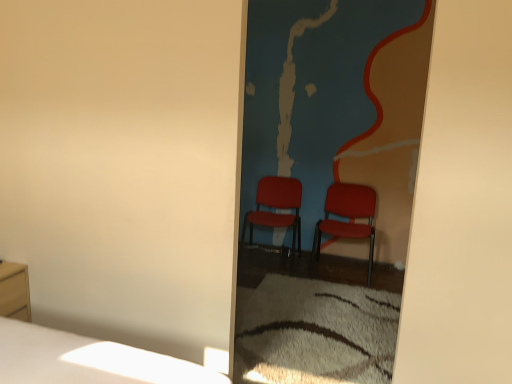
Image resolution: width=512 pixels, height=384 pixels. What do you see at coordinates (14, 290) in the screenshot? I see `matte wood nightstand at lower left` at bounding box center [14, 290].

From the picture: Measure the distance between point (20, 306) and camera.

The depth of point (20, 306) is 8.53 feet.

You are a GUI agent. You are given a task and a screenshot of the screen. Output one action in this format:
    pyautogui.click(x=<x>, y=<y>)
    Task: Click on the matte red chair at center, the 1th chair from the left
    
    Given the screenshot: What is the action you would take?
    pyautogui.click(x=276, y=207)

From their relative heights in the image, would you say matte wood nightstand at lower left is taller or shorter than matte red chairs at center?

In the image, matte wood nightstand at lower left appears to be shorter than matte red chairs at center.

Is matte wood nightstand at lower left located outside matte red chairs at center?

matte wood nightstand at lower left lies outside matte red chairs at center's area.

At what (x,y) coordinates should I click in order to perform the action: click on screen door in front of the matte wood nightstand at lower left. Please return your answer as a coordinate pair (x, y). This screenshot has height=384, width=512. Looking at the image, I should click on (337, 105).

Which object is more forward, matte wood nightstand at lower left or matte red chairs at center?

matte red chairs at center.

Can you tell me how much matte wood nightstand at lower left and matte plastic chair at center, acting as the 1th chair starting from the right, differ in facing direction?

93.1 degrees separate the facing orientations of matte wood nightstand at lower left and matte plastic chair at center, acting as the 1th chair starting from the right.

From the image's perspective, relative to matte plastic chair at center, which is the second chair from left to right, is matte wood nightstand at lower left above or below?

Clearly, from the image's perspective, matte wood nightstand at lower left is below matte plastic chair at center, which is the second chair from left to right.

Considering the relative positions of matte wood nightstand at lower left and matte plastic chair at center, acting as the 1th chair starting from the right, in the image provided, is matte wood nightstand at lower left to the left or to the right of matte plastic chair at center, acting as the 1th chair starting from the right,?

Clearly, matte wood nightstand at lower left is on the left of matte plastic chair at center, acting as the 1th chair starting from the right, in the image.

Between point (23, 293) and point (328, 197), which one is positioned behind?

The point (328, 197) is behind.

Identify the location of furniture in front of the matte red chair at center, the 1th chair from the left. The width and height of the screenshot is (512, 384). (14, 290).

Based on the photo, does matte wood nightstand at lower left turn towards matte red chair at center, the second chair from the right?

No.

Is matte wood nightstand at lower left far from matte red chair at center, the 1th chair from the left?

Yes, matte wood nightstand at lower left and matte red chair at center, the 1th chair from the left, are located far from each other.

From the image's perspective, relative to matte red chair at center, the second chair from the right, is matte wood nightstand at lower left above or below?

Clearly, from the image's perspective, matte wood nightstand at lower left is below matte red chair at center, the second chair from the right.

How many degrees apart are the facing directions of matte red chair at center, the second chair from the right, and matte red chairs at center?

There is a 6.27-degree angle between the facing directions of matte red chair at center, the second chair from the right, and matte red chairs at center.

The width and height of the screenshot is (512, 384). I want to click on screen door lying in front of the matte red chair at center, the 1th chair from the left, so click(337, 105).

Between point (293, 248) and point (401, 130), which one is positioned in front?

The point (401, 130) is in front.

Is matte red chair at center, the second chair from the right, to the left or to the right of matte red chairs at center in the image?

matte red chair at center, the second chair from the right, is positioned on matte red chairs at center's left side.

Considering the positions of objects matte plastic chair at center, acting as the 1th chair starting from the right, and matte red chair at center, the 1th chair from the left, in the image provided, who is in front, matte plastic chair at center, acting as the 1th chair starting from the right, or matte red chair at center, the 1th chair from the left,?

matte plastic chair at center, acting as the 1th chair starting from the right, is more forward.

Image resolution: width=512 pixels, height=384 pixels. I want to click on chair in front of the matte red chair at center, the second chair from the right, so click(x=348, y=216).

Which is more to the left, matte plastic chair at center, acting as the 1th chair starting from the right, or matte red chair at center, the 1th chair from the left?

matte red chair at center, the 1th chair from the left.

Looking at the image, does matte plastic chair at center, acting as the 1th chair starting from the right, seem bigger or smaller compared to matte red chair at center, the 1th chair from the left?

Considering their sizes, matte plastic chair at center, acting as the 1th chair starting from the right, takes up less space than matte red chair at center, the 1th chair from the left.

At what (x,y) coordinates should I click in order to perform the action: click on chair on the left of the matte red chairs at center. Please return your answer as a coordinate pair (x, y). The width and height of the screenshot is (512, 384). Looking at the image, I should click on (276, 207).

Is matte red chairs at center facing away from matte red chair at center, the 1th chair from the left?

Yes, matte red chairs at center is positioned with its back facing matte red chair at center, the 1th chair from the left.

Is matte red chairs at center taller than matte red chair at center, the second chair from the right?

Indeed, matte red chairs at center has a greater height compared to matte red chair at center, the second chair from the right.

Based on the photo, considering their positions, is matte plastic chair at center, which is the second chair from left to right, located in front of or behind matte red chairs at center?

matte plastic chair at center, which is the second chair from left to right, is behind matte red chairs at center.

Is matte plastic chair at center, acting as the 1th chair starting from the right, shorter than matte red chairs at center?

Yes, matte plastic chair at center, acting as the 1th chair starting from the right, is shorter than matte red chairs at center.

Is matte plastic chair at center, which is the second chair from left to right, positioned far away from matte red chairs at center?

They are positioned close to each other.

Is matte plastic chair at center, which is the second chair from left to right, inside the boundaries of matte red chairs at center, or outside?

matte plastic chair at center, which is the second chair from left to right, exists outside the volume of matte red chairs at center.

Locate an element on the screen. This screenshot has width=512, height=384. furniture below the matte red chairs at center (from a real-world perspective) is located at coordinates (14, 290).

Identify the location of furniture below the matte plastic chair at center, acting as the 1th chair starting from the right (from the image's perspective). (14, 290).

Based on their spatial positions, is matte plastic chair at center, which is the second chair from left to right, or matte wood nightstand at lower left further from matte red chairs at center?

Among the two, matte wood nightstand at lower left is located further to matte red chairs at center.

Considering their positions, is matte red chair at center, the 1th chair from the left, positioned closer to matte plastic chair at center, which is the second chair from left to right, than matte wood nightstand at lower left?

The object closer to matte plastic chair at center, which is the second chair from left to right, is matte red chair at center, the 1th chair from the left.

From the image, which object appears to be farther from matte red chairs at center, matte plastic chair at center, acting as the 1th chair starting from the right, or matte red chair at center, the 1th chair from the left?

matte red chair at center, the 1th chair from the left, is further to matte red chairs at center.

When comparing their distances from matte red chairs at center, does matte red chair at center, the 1th chair from the left, or matte plastic chair at center, acting as the 1th chair starting from the right, seem further?

The object further to matte red chairs at center is matte red chair at center, the 1th chair from the left.

Which object lies nearer to the anchor point matte red chairs at center, matte wood nightstand at lower left or matte plastic chair at center, acting as the 1th chair starting from the right?

matte plastic chair at center, acting as the 1th chair starting from the right, is closer to matte red chairs at center.

When comparing their distances from matte wood nightstand at lower left, does matte red chair at center, the second chair from the right, or matte red chairs at center seem closer?

The object closer to matte wood nightstand at lower left is matte red chair at center, the second chair from the right.

Considering their positions, is matte plastic chair at center, which is the second chair from left to right, positioned further to matte red chair at center, the second chair from the right, than matte red chairs at center?

Based on the image, matte red chairs at center appears to be further to matte red chair at center, the second chair from the right.

When comparing their distances from matte plastic chair at center, acting as the 1th chair starting from the right, does matte red chair at center, the 1th chair from the left, or matte red chairs at center seem further?

matte red chairs at center is further to matte plastic chair at center, acting as the 1th chair starting from the right.

Locate an element on the screen. screen door between matte wood nightstand at lower left and matte plastic chair at center, which is the second chair from left to right, from left to right is located at coordinates (337, 105).

You are a GUI agent. You are given a task and a screenshot of the screen. Output one action in this format:
    pyautogui.click(x=<x>, y=<y>)
    Task: Click on the chair between matte wood nightstand at lower left and matte plastic chair at center, acting as the 1th chair starting from the right, in the horizontal direction
    Image resolution: width=512 pixels, height=384 pixels.
    Given the screenshot: What is the action you would take?
    pyautogui.click(x=276, y=207)

Identify the location of furniture located between matte red chairs at center and matte red chair at center, the second chair from the right, in the depth direction. (x=14, y=290).

I want to click on chair positioned between matte red chairs at center and matte red chair at center, the second chair from the right, from near to far, so click(x=348, y=216).